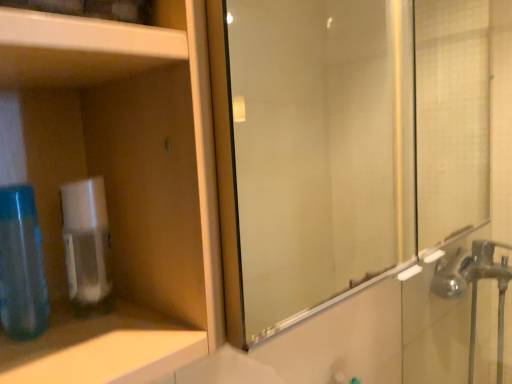
The width and height of the screenshot is (512, 384). What are the coordinates of `matte plastic cabinet at left` in the screenshot? It's located at (117, 186).

I want to click on clear plastic soap dispenser at left, so click(x=87, y=246).

This screenshot has width=512, height=384. What are the coordinates of `silver metallic faucet at right` in the screenshot? It's located at (476, 292).

What do you see at coordinates (21, 265) in the screenshot?
I see `blue translucent bottle at left` at bounding box center [21, 265].

What do you see at coordinates (79, 49) in the screenshot? I see `white glossy cabinet at upper left` at bounding box center [79, 49].

This screenshot has height=384, width=512. Find the location of `matte plastic cabinet at left`. matte plastic cabinet at left is located at coordinates pos(117,186).

Is white glossy cabinet at upper left situated inside clear plastic soap dispenser at left or outside?

The correct answer is: outside.

Consider the image. From the image's perspective, which one is positioned higher, white glossy cabinet at upper left or clear plastic soap dispenser at left?

From the image's view, white glossy cabinet at upper left is above.

Find the location of a particular element. cabinet that is above the clear plastic soap dispenser at left (from a real-world perspective) is located at coordinates (79, 49).

From the picture: Is white glossy cabinet at upper left taller or shorter than clear plastic soap dispenser at left?

In the image, white glossy cabinet at upper left appears to be taller than clear plastic soap dispenser at left.

From the picture: Does blue translucent bottle at left have a greater height compared to silver metallic faucet at right?

No.

Is blue translucent bottle at left further to camera compared to silver metallic faucet at right?

No, blue translucent bottle at left is in front of silver metallic faucet at right.

This screenshot has width=512, height=384. In order to click on faucet on the right of blue translucent bottle at left in this screenshot , I will do `click(476, 292)`.

Which is behind, point (20, 273) or point (472, 287)?

The point (472, 287) is farther from the camera.

Would you consider silver metallic faucet at right to be distant from matte plastic cabinet at left?

Yes.

From the image's perspective, is silver metallic faucet at right on matte plastic cabinet at left?

No, from the image's perspective, silver metallic faucet at right is not above matte plastic cabinet at left.

Considering the positions of objects silver metallic faucet at right and matte plastic cabinet at left in the image provided, who is more to the right, silver metallic faucet at right or matte plastic cabinet at left?

silver metallic faucet at right is more to the right.

From a real-world perspective, which object rests below the other?

In real-world perspective, silver metallic faucet at right is lower.

Considering the relative sizes of white glossy cabinet at upper left and silver metallic faucet at right in the image provided, is white glossy cabinet at upper left bigger than silver metallic faucet at right?

No.

Find the location of a particular element. This screenshot has width=512, height=384. faucet lying behind the white glossy cabinet at upper left is located at coordinates (476, 292).

Could you tell me if white glossy cabinet at upper left is facing blue translucent bottle at left?

No.

Which object is more forward, white glossy cabinet at upper left or blue translucent bottle at left?

white glossy cabinet at upper left.

In the image, is white glossy cabinet at upper left on the left side or the right side of blue translucent bottle at left?

Based on their positions, white glossy cabinet at upper left is located to the right of blue translucent bottle at left.

Looking at this image, would you say white glossy cabinet at upper left is a long distance from blue translucent bottle at left?

They are positioned close to each other.

Between matte plastic cabinet at left and silver metallic faucet at right, which one has smaller size?

matte plastic cabinet at left.

In terms of height, does matte plastic cabinet at left look taller or shorter compared to silver metallic faucet at right?

Considering their sizes, matte plastic cabinet at left has less height than silver metallic faucet at right.

From the image's perspective, which object appears higher, matte plastic cabinet at left or silver metallic faucet at right?

matte plastic cabinet at left, from the image's perspective.

Is point (12, 120) more distant than point (91, 290)?

That is False.

From the image's perspective, is matte plastic cabinet at left beneath clear plastic soap dispenser at left?

Incorrect, from the image's perspective, matte plastic cabinet at left is higher than clear plastic soap dispenser at left.

Locate an element on the screen. soap dispenser that is on the right side of matte plastic cabinet at left is located at coordinates (87, 246).

Is matte plastic cabinet at left far from clear plastic soap dispenser at left?

matte plastic cabinet at left is near clear plastic soap dispenser at left, not far away.

Locate an element on the screen. The height and width of the screenshot is (384, 512). cabinet located above the clear plastic soap dispenser at left (from the image's perspective) is located at coordinates (79, 49).

Find the location of `faucet that is under the blue translucent bottle at left (from a real-world perspective)`. faucet that is under the blue translucent bottle at left (from a real-world perspective) is located at coordinates (476, 292).

Estimate the real-world distances between objects in this image. Which object is closer to matte plastic cabinet at left, blue translucent bottle at left or clear plastic soap dispenser at left?

clear plastic soap dispenser at left is positioned closer to the anchor matte plastic cabinet at left.

Estimate the real-world distances between objects in this image. Which object is further from matte plastic cabinet at left, silver metallic faucet at right or white glossy cabinet at upper left?

silver metallic faucet at right lies further to matte plastic cabinet at left than the other object.

Which object lies nearer to the anchor point matte plastic cabinet at left, clear plastic soap dispenser at left or silver metallic faucet at right?

clear plastic soap dispenser at left lies closer to matte plastic cabinet at left than the other object.

Consider the image. Which object lies nearer to the anchor point white glossy cabinet at upper left, clear plastic soap dispenser at left or blue translucent bottle at left?

clear plastic soap dispenser at left is closer to white glossy cabinet at upper left.

Based on their spatial positions, is blue translucent bottle at left or white glossy cabinet at upper left further from matte plastic cabinet at left?

blue translucent bottle at left.

Based on their spatial positions, is blue translucent bottle at left or silver metallic faucet at right closer to white glossy cabinet at upper left?

Among the two, blue translucent bottle at left is located nearer to white glossy cabinet at upper left.

Estimate the real-world distances between objects in this image. Which object is further from white glossy cabinet at upper left, blue translucent bottle at left or clear plastic soap dispenser at left?

The object further to white glossy cabinet at upper left is blue translucent bottle at left.

Which object lies nearer to the anchor point white glossy cabinet at upper left, matte plastic cabinet at left or silver metallic faucet at right?

Among the two, matte plastic cabinet at left is located nearer to white glossy cabinet at upper left.

I want to click on cabinetry between white glossy cabinet at upper left and silver metallic faucet at right in the horizontal direction, so click(x=117, y=186).

Where is `mouthwash between matte plastic cabinet at left and clear plastic soap dispenser at left along the z-axis`? mouthwash between matte plastic cabinet at left and clear plastic soap dispenser at left along the z-axis is located at coordinates (21, 265).

Identify the location of cabinetry between blue translucent bottle at left and silver metallic faucet at right from left to right. (117, 186).

The image size is (512, 384). Identify the location of soap dispenser between blue translucent bottle at left and silver metallic faucet at right from left to right. (87, 246).